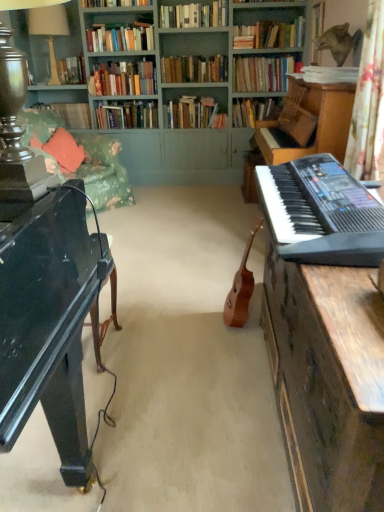
Where is `free space above hardcover books at upper center, which is the sixth book in front-to-back order (from a real-world perspective)`? This screenshot has height=512, width=384. free space above hardcover books at upper center, which is the sixth book in front-to-back order (from a real-world perspective) is located at coordinates (118, 58).